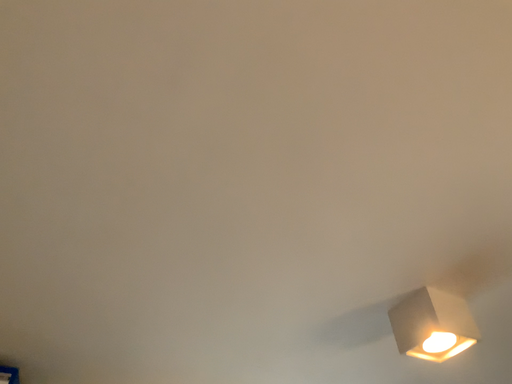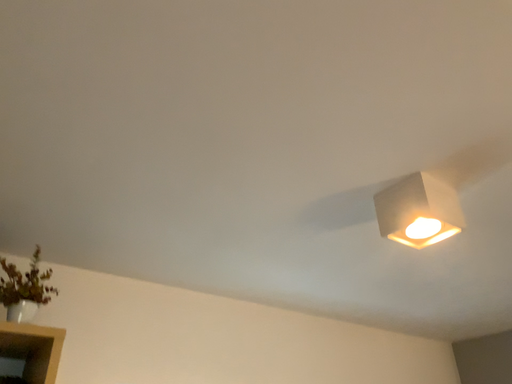
Question: Which way did the camera rotate in the video?

Choices:
 (A) rotated downward
 (B) rotated upward

Answer: (A)